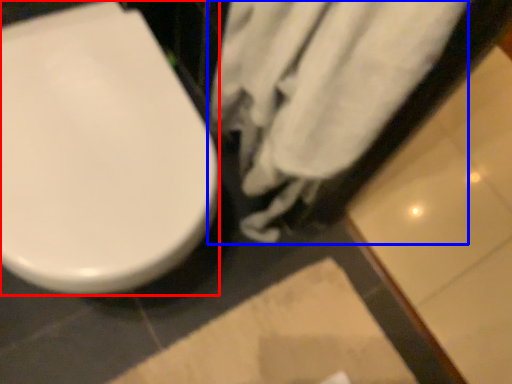
Question: Which of the following is the farthest to the observer, toilet (highlighted by a red box) or bath towel (highlighted by a blue box)?

Choices:
 (A) toilet
 (B) bath towel

Answer: (A)